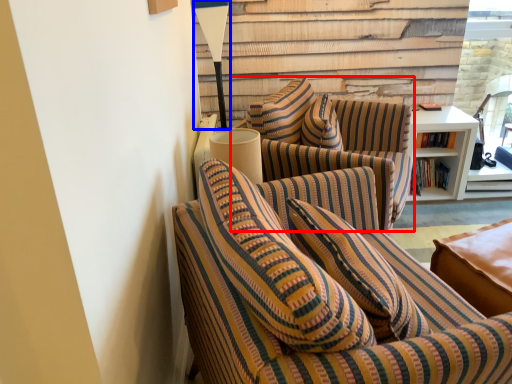
Question: Which point is closer to the camera, studio couch (highlighted by a red box) or table lamp (highlighted by a blue box)?

Choices:
 (A) studio couch
 (B) table lamp

Answer: (A)